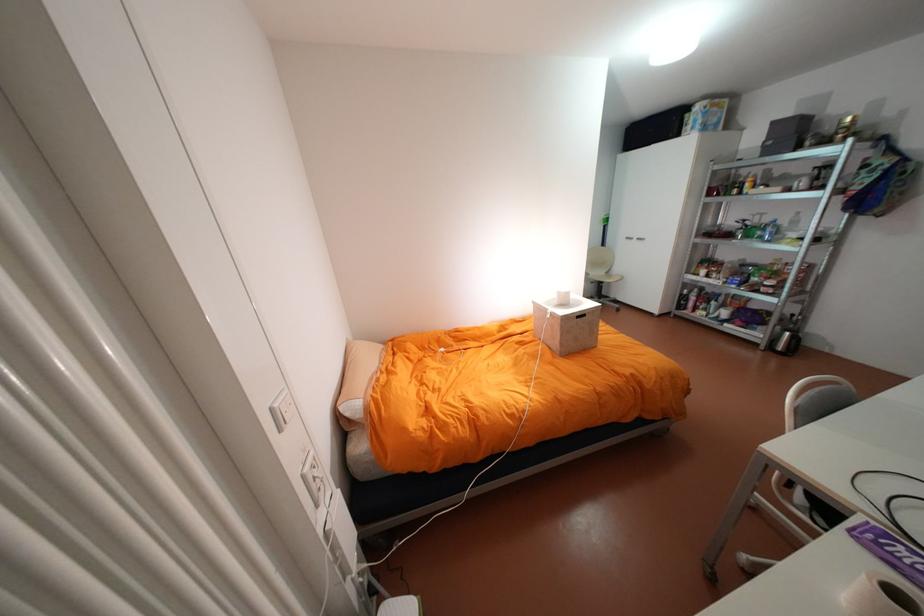
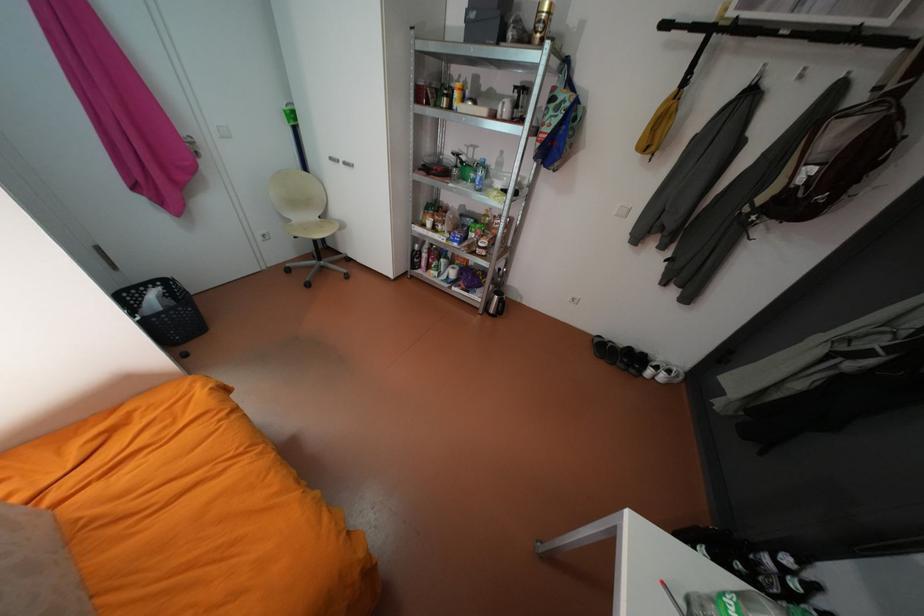
Find the pixel in the second image that matches (640,238) in the first image.

(347, 160)